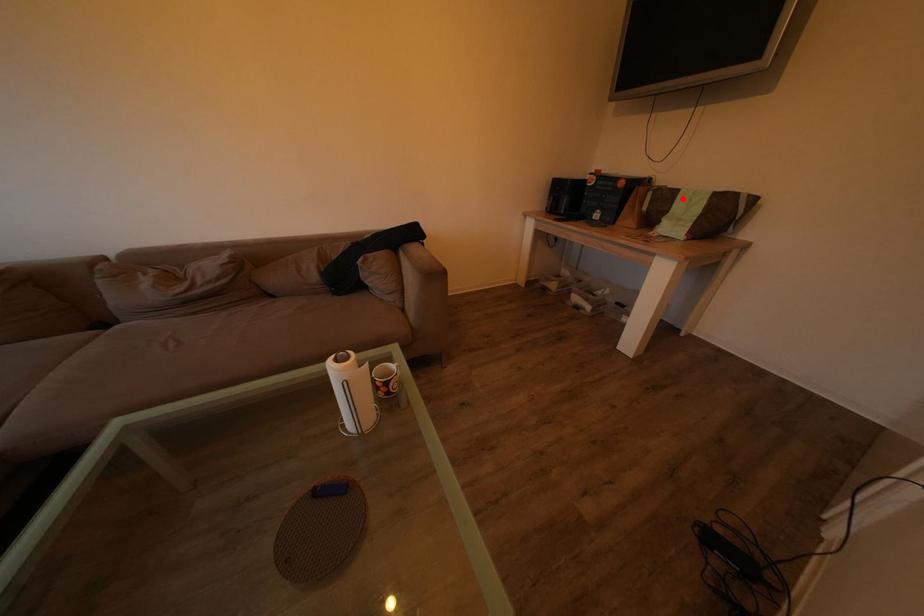
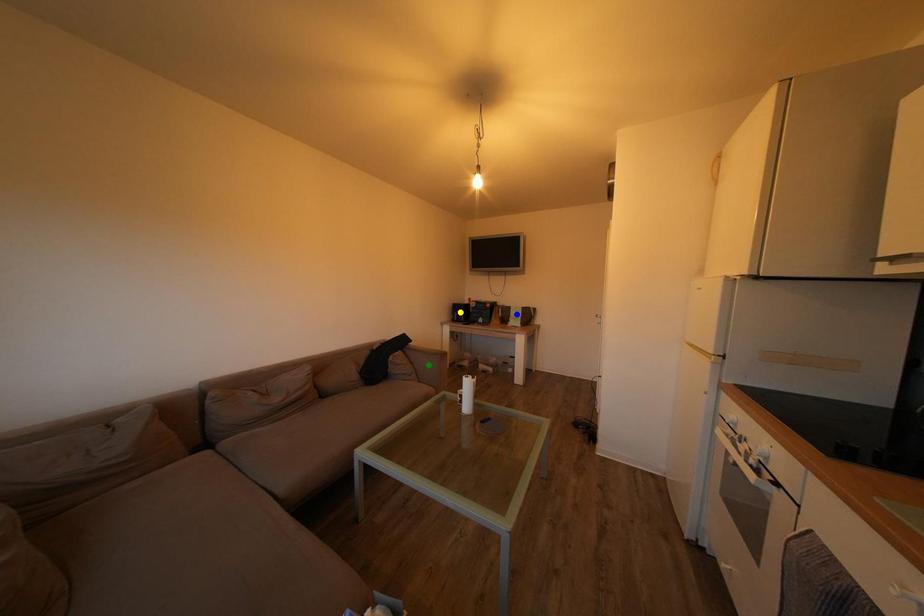
Question: I am providing you with two images of the same scene from different viewpoints. A red point is marked on the first image. You are given multiple points on the second image. Which spot in image 2 lines up with the point in image 1?

Choices:
 (A) green point
 (B) blue point
 (C) yellow point

Answer: (B)